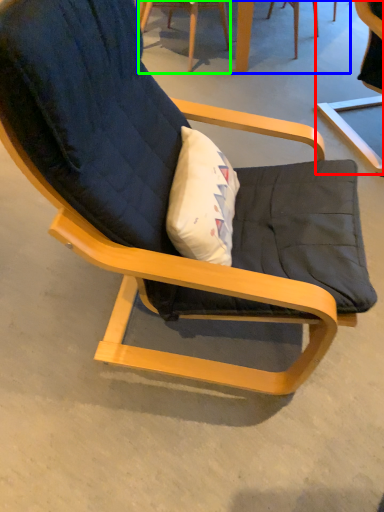
Question: Considering the real-world distances, which object is farthest from chair (highlighted by a red box)? table (highlighted by a blue box) or chair (highlighted by a green box)?

Choices:
 (A) table
 (B) chair

Answer: (B)